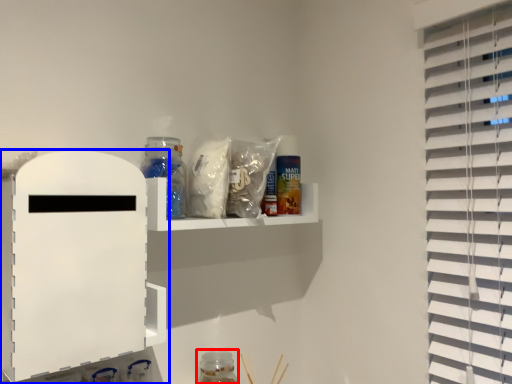
Question: Which object appears closest to the camera in this image, bottle (highlighted by a red box) or shelf (highlighted by a blue box)?

Choices:
 (A) bottle
 (B) shelf

Answer: (B)